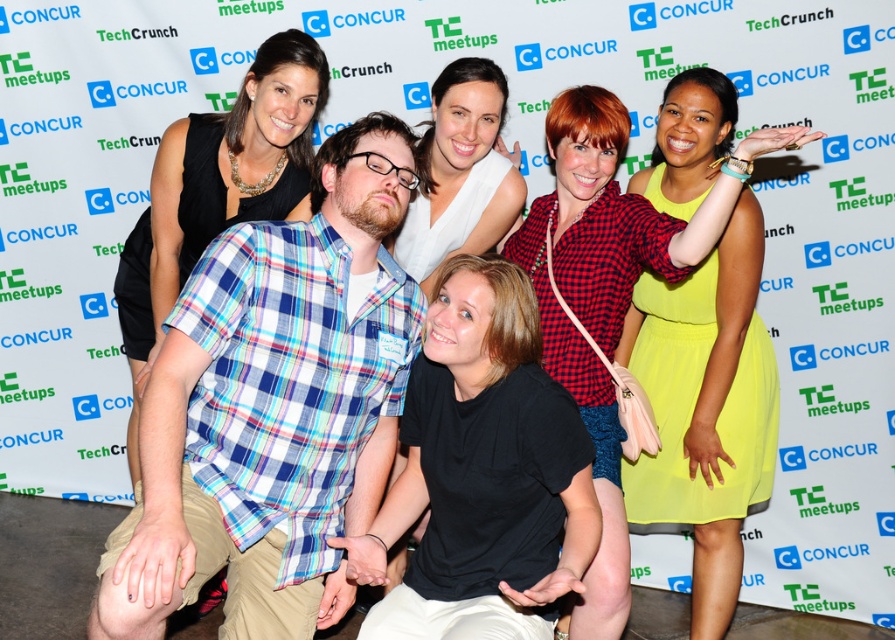
Question: Which of the following is the farthest from the observer?

Choices:
 (A) (x=267, y=616)
 (B) (x=203, y=170)
 (C) (x=591, y=456)
 (D) (x=428, y=257)

Answer: (D)

Question: Among these points, which one is farthest from the camera?

Choices:
 (A) (749, 243)
 (B) (467, 602)

Answer: (A)

Question: Which point is closer to the camera?

Choices:
 (A) (449, 472)
 (B) (484, 186)

Answer: (A)

Question: Does black matte shirt at center appear on the left side of matte red checkered shirt at center?

Choices:
 (A) yes
 (B) no

Answer: (A)

Question: Is black matte shirt at center wider than matte red checkered shirt at center?

Choices:
 (A) yes
 (B) no

Answer: (A)

Question: Is plaid cotton shirt at center to the right of black jersey at center from the viewer's perspective?

Choices:
 (A) no
 (B) yes

Answer: (B)